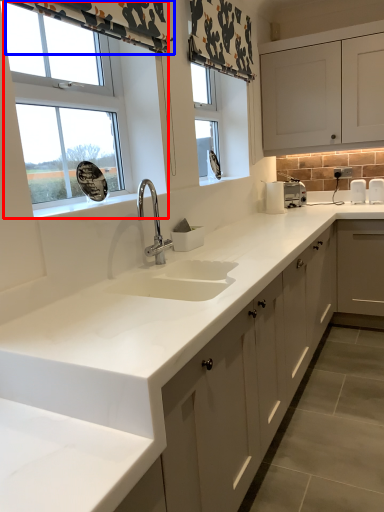
Question: Which object is closer to the camera taking this photo, window (highlighted by a red box) or curtain (highlighted by a blue box)?

Choices:
 (A) window
 (B) curtain

Answer: (B)